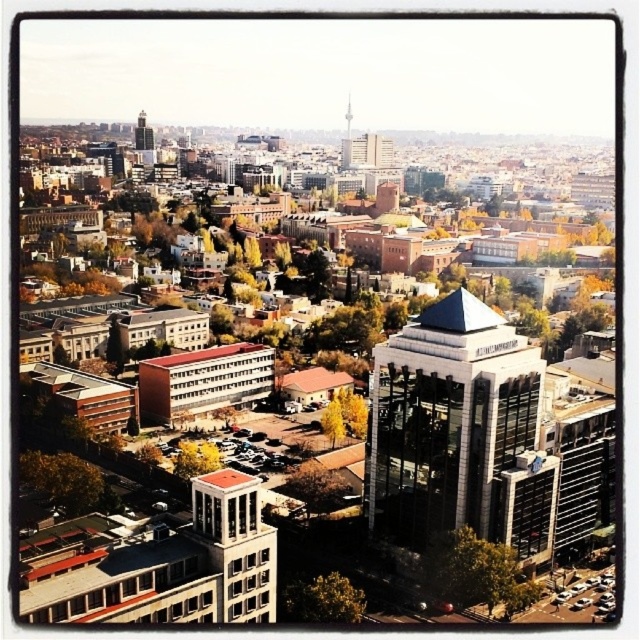
Where is `glassy silver tower at center`? glassy silver tower at center is located at coordinates (458, 433).

Does point (369, 445) come farther from viewer compared to point (150, 144)?

No, it is not.

You are a GUI agent. You are given a task and a screenshot of the screen. Output one action in this format:
    pyautogui.click(x=<x>, y=<y>)
    Task: Click on the glassy silver tower at center
    The width and height of the screenshot is (640, 640).
    Given the screenshot: What is the action you would take?
    pyautogui.click(x=458, y=433)

Between point (454, 445) and point (208, 442), which one is positioned behind?

The point (208, 442) is more distant.

Locate an element on the screen. The image size is (640, 640). glassy silver tower at center is located at coordinates point(458,433).

Does green leafy tree at lower right appear over yellow-green leaves at center?

Actually, green leafy tree at lower right is below yellow-green leaves at center.

Is green leafy tree at lower right bigger than yellow-green leaves at center?

No.

Find the location of `green leafy tree at lower right`. green leafy tree at lower right is located at coordinates (476, 573).